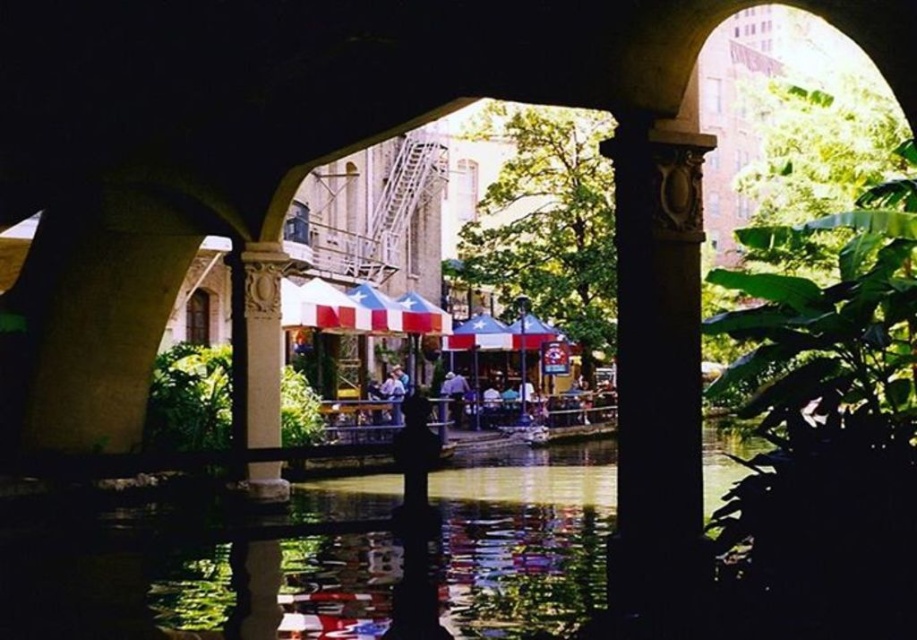
You are an architect examining the structure of the arched riverside scene. Which column, the carved stone column at center or the white stone column at center, would require more material to construct?

The carved stone column at center is bigger than the white stone column at center, so it would require more material to construct.